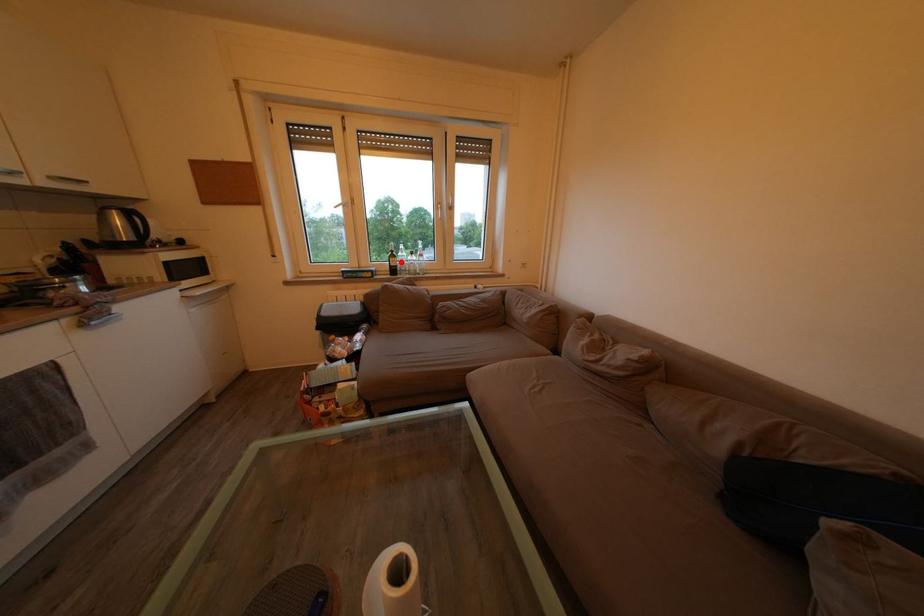
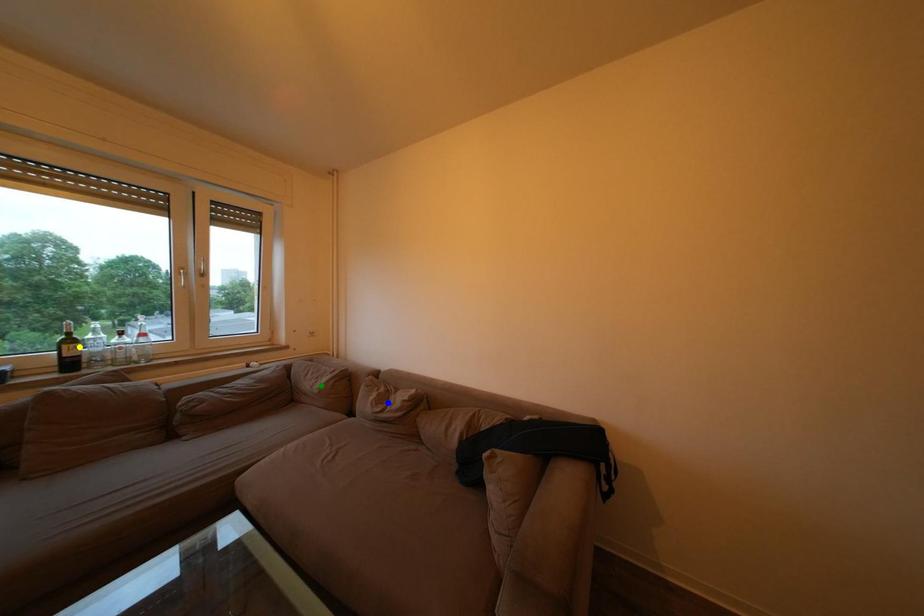
Question: I am providing you with two images of the same scene from different viewpoints. A red point is marked on the first image. You are given multiple points on the second image. Can you choose the point in image 2 that corresponds to the point in image 1?

Choices:
 (A) blue point
 (B) yellow point
 (C) green point

Answer: (B)